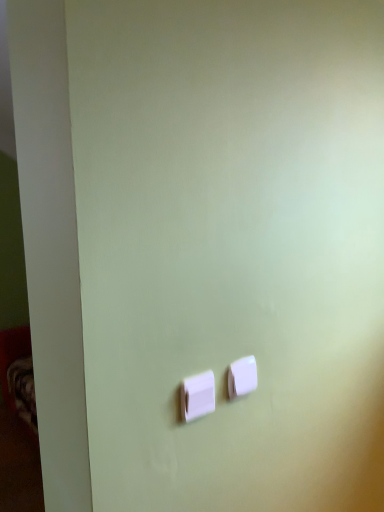
The image size is (384, 512). I want to click on white plastic light switch at center, the 1th light switch viewed from the back, so click(x=242, y=377).

Image resolution: width=384 pixels, height=512 pixels. What do you see at coordinates (242, 377) in the screenshot? I see `white plastic light switch at center, the 2th light switch in the left-to-right sequence` at bounding box center [242, 377].

Where is `white plastic light switch at center, which appears as the second light switch when viewed from the back`? Image resolution: width=384 pixels, height=512 pixels. white plastic light switch at center, which appears as the second light switch when viewed from the back is located at coordinates (197, 396).

This screenshot has height=512, width=384. Describe the element at coordinates (197, 396) in the screenshot. I see `white plastic light switch at center, which is the 1th light switch from front to back` at that location.

At what (x,y) coordinates should I click in order to perform the action: click on white plastic light switch at center, the 1th light switch viewed from the back. Please return your answer as a coordinate pair (x, y). This screenshot has width=384, height=512. Looking at the image, I should click on (242, 377).

Looking at this image, is white plastic light switch at center, which appears as the second light switch when viewed from the back, to the right of white plastic light switch at center, which is the first light switch from right to left, from the viewer's perspective?

No.

In the image, is white plastic light switch at center, marked as the 1th light switch in a left-to-right arrangement, positioned in front of or behind white plastic light switch at center, the 1th light switch viewed from the back?

white plastic light switch at center, marked as the 1th light switch in a left-to-right arrangement, is positioned closer to the viewer than white plastic light switch at center, the 1th light switch viewed from the back.

Which is closer to the camera, (x=208, y=408) or (x=230, y=379)?

Positioned in front is point (x=208, y=408).

From the image's perspective, which is below, white plastic light switch at center, which is the 1th light switch from front to back, or white plastic light switch at center, the 1th light switch viewed from the back?

white plastic light switch at center, which is the 1th light switch from front to back, appears lower in the image.

From a real-world perspective, which is physically above, white plastic light switch at center, which is the 1th light switch from front to back, or white plastic light switch at center, the 1th light switch viewed from the back?

white plastic light switch at center, the 1th light switch viewed from the back, is physically above.

Considering the relative sizes of white plastic light switch at center, which is the 1th light switch from front to back, and white plastic light switch at center, the 2th light switch in the left-to-right sequence, in the image provided, is white plastic light switch at center, which is the 1th light switch from front to back, wider than white plastic light switch at center, the 2th light switch in the left-to-right sequence,?

Indeed, white plastic light switch at center, which is the 1th light switch from front to back, has a greater width compared to white plastic light switch at center, the 2th light switch in the left-to-right sequence.

Does white plastic light switch at center, which appears as the second light switch when viewed from the back, have a lesser height compared to white plastic light switch at center, the 1th light switch viewed from the back?

In fact, white plastic light switch at center, which appears as the second light switch when viewed from the back, may be taller than white plastic light switch at center, the 1th light switch viewed from the back.

Is white plastic light switch at center, which appears as the second light switch when viewed from the back, smaller than white plastic light switch at center, marked as the 2th light switch in a front-to-back arrangement?

No.

Is white plastic light switch at center, which appears as the second light switch when viewed from the back, not inside white plastic light switch at center, marked as the 2th light switch in a front-to-back arrangement?

That's correct, white plastic light switch at center, which appears as the second light switch when viewed from the back, is outside of white plastic light switch at center, marked as the 2th light switch in a front-to-back arrangement.

Would you say white plastic light switch at center, marked as the 1th light switch in a left-to-right arrangement, is a long distance from white plastic light switch at center, the 2th light switch in the left-to-right sequence?

No, there isn't a large distance between white plastic light switch at center, marked as the 1th light switch in a left-to-right arrangement, and white plastic light switch at center, the 2th light switch in the left-to-right sequence.

Is white plastic light switch at center, which appears as the second light switch when viewed from the back, oriented towards white plastic light switch at center, which is the first light switch from right to left?

No, white plastic light switch at center, which appears as the second light switch when viewed from the back, is not aimed at white plastic light switch at center, which is the first light switch from right to left.

Can you tell me how much white plastic light switch at center, marked as the 1th light switch in a left-to-right arrangement, and white plastic light switch at center, the 2th light switch in the left-to-right sequence, differ in facing direction?

0.00516 degrees.

Image resolution: width=384 pixels, height=512 pixels. In order to click on light switch that appears on the right of white plastic light switch at center, marked as the 1th light switch in a left-to-right arrangement in this screenshot , I will do `click(242, 377)`.

Which object is positioned more to the right, white plastic light switch at center, the 2th light switch in the left-to-right sequence, or white plastic light switch at center, which appears as the second light switch when viewed from the back?

From the viewer's perspective, white plastic light switch at center, the 2th light switch in the left-to-right sequence, appears more on the right side.

Considering their positions, is white plastic light switch at center, the 2th light switch in the left-to-right sequence, located in front of or behind white plastic light switch at center, marked as the 1th light switch in a left-to-right arrangement?

white plastic light switch at center, the 2th light switch in the left-to-right sequence, is positioned farther from the viewer than white plastic light switch at center, marked as the 1th light switch in a left-to-right arrangement.

Which is closer to the camera, (248,376) or (211,405)?

Point (248,376).

From the image's perspective, is white plastic light switch at center, which is the first light switch from right to left, on white plastic light switch at center, which appears as the 2th light switch when viewed from the right?

Yes, from the image's perspective, white plastic light switch at center, which is the first light switch from right to left, is on top of white plastic light switch at center, which appears as the 2th light switch when viewed from the right.

From a real-world perspective, which is physically above, white plastic light switch at center, the 1th light switch viewed from the back, or white plastic light switch at center, marked as the 1th light switch in a left-to-right arrangement?

white plastic light switch at center, the 1th light switch viewed from the back.

Considering the sizes of white plastic light switch at center, which is the first light switch from right to left, and white plastic light switch at center, marked as the 1th light switch in a left-to-right arrangement, in the image, is white plastic light switch at center, which is the first light switch from right to left, wider or thinner than white plastic light switch at center, marked as the 1th light switch in a left-to-right arrangement,?

In the image, white plastic light switch at center, which is the first light switch from right to left, appears to be more narrow than white plastic light switch at center, marked as the 1th light switch in a left-to-right arrangement.

Does white plastic light switch at center, the 1th light switch viewed from the back, have a greater height compared to white plastic light switch at center, which appears as the 2th light switch when viewed from the right?

Incorrect, the height of white plastic light switch at center, the 1th light switch viewed from the back, is not larger of that of white plastic light switch at center, which appears as the 2th light switch when viewed from the right.

Who is bigger, white plastic light switch at center, marked as the 2th light switch in a front-to-back arrangement, or white plastic light switch at center, which appears as the second light switch when viewed from the back?

With larger size is white plastic light switch at center, which appears as the second light switch when viewed from the back.

Is white plastic light switch at center, which is the first light switch from right to left, inside or outside of white plastic light switch at center, marked as the 1th light switch in a left-to-right arrangement?

white plastic light switch at center, which is the first light switch from right to left, is not enclosed by white plastic light switch at center, marked as the 1th light switch in a left-to-right arrangement.

Is white plastic light switch at center, marked as the 2th light switch in a front-to-back arrangement, with white plastic light switch at center, which appears as the 2th light switch when viewed from the right?

Yes, white plastic light switch at center, marked as the 2th light switch in a front-to-back arrangement, and white plastic light switch at center, which appears as the 2th light switch when viewed from the right, clearly make contact.

Is white plastic light switch at center, which appears as the 2th light switch when viewed from the right, at the back of white plastic light switch at center, the 2th light switch in the left-to-right sequence?

No, white plastic light switch at center, which appears as the 2th light switch when viewed from the right, is not at the back of white plastic light switch at center, the 2th light switch in the left-to-right sequence.

How many degrees apart are the facing directions of white plastic light switch at center, the 1th light switch viewed from the back, and white plastic light switch at center, which appears as the 2th light switch when viewed from the right?

The facing directions of white plastic light switch at center, the 1th light switch viewed from the back, and white plastic light switch at center, which appears as the 2th light switch when viewed from the right, are 0.00516 degrees apart.

Measure the distance between white plastic light switch at center, the 1th light switch viewed from the back, and white plastic light switch at center, marked as the 1th light switch in a left-to-right arrangement.

They are 3.45 inches apart.

What are the coordinates of `light switch that appears below the white plastic light switch at center, which is the first light switch from right to left (from a real-world perspective)` in the screenshot? It's located at (197, 396).

The height and width of the screenshot is (512, 384). Find the location of `light switch below the white plastic light switch at center, the 2th light switch in the left-to-right sequence (from a real-world perspective)`. light switch below the white plastic light switch at center, the 2th light switch in the left-to-right sequence (from a real-world perspective) is located at coordinates (197, 396).

Locate an element on the screen. light switch positioned vertically above the white plastic light switch at center, which appears as the second light switch when viewed from the back (from a real-world perspective) is located at coordinates (242, 377).